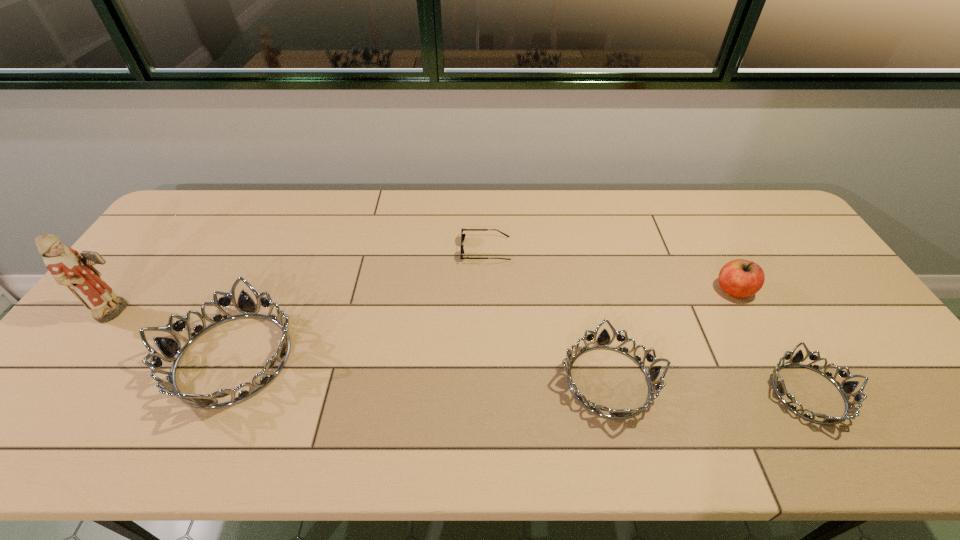
Where is `apple`? The width and height of the screenshot is (960, 540). apple is located at coordinates (739, 278).

Locate an element on the screen. vacant area located 0.050m on the front-facing side of the tallest tiara is located at coordinates tap(144, 359).

Find the location of a particular element. vacant area situated on the front-facing side of the tallest tiara is located at coordinates pos(78,359).

Identify the location of free space located on the front-facing side of the tallest tiara. The height and width of the screenshot is (540, 960). (97, 359).

What are the coordinates of `vacant area located on the front-facing side of the fifth tallest object` in the screenshot? It's located at (620, 393).

Identify the location of vacant space located on the front-facing side of the fifth tallest object. The width and height of the screenshot is (960, 540). (716, 393).

At what (x,y) coordinates should I click in order to perform the action: click on vacant space located on the front-facing side of the fifth tallest object. Please return your answer as a coordinate pair (x, y). Image resolution: width=960 pixels, height=540 pixels. Looking at the image, I should click on (620, 393).

At what (x,y) coordinates should I click in order to perform the action: click on vacant space situated on the front-facing side of the tallest object. Please return your answer as a coordinate pair (x, y). Image resolution: width=960 pixels, height=540 pixels. Looking at the image, I should click on (264, 312).

Where is `vacant space located on the front-facing side of the farthest object`? The height and width of the screenshot is (540, 960). vacant space located on the front-facing side of the farthest object is located at coordinates (389, 249).

The width and height of the screenshot is (960, 540). What are the coordinates of `vacant region located 0.280m on the front-facing side of the farthest object` in the screenshot? It's located at (372, 249).